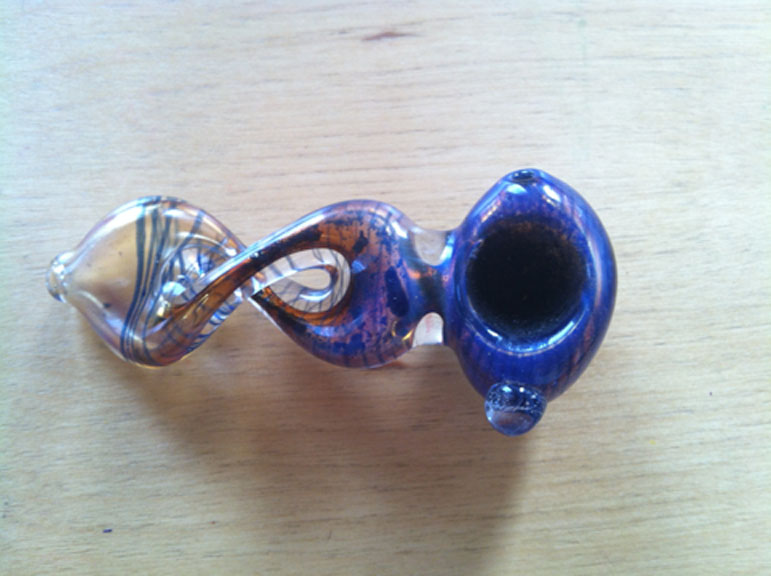
You are a GUI agent. You are given a task and a screenshot of the screen. Output one action in this format:
    pyautogui.click(x=<x>, y=<y>)
    Task: Click on the bowl
    The height and width of the screenshot is (576, 771).
    Given the screenshot: What is the action you would take?
    (x=532, y=288)